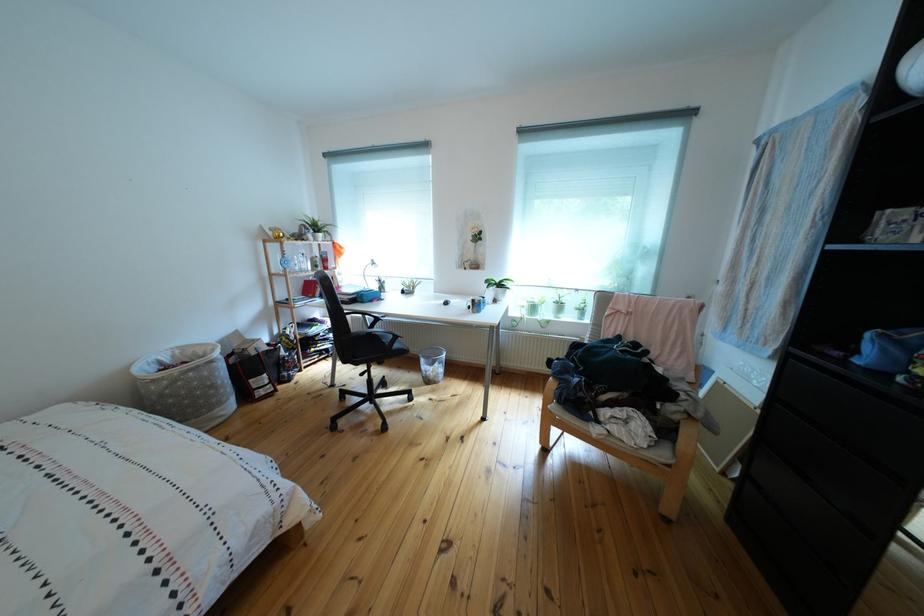
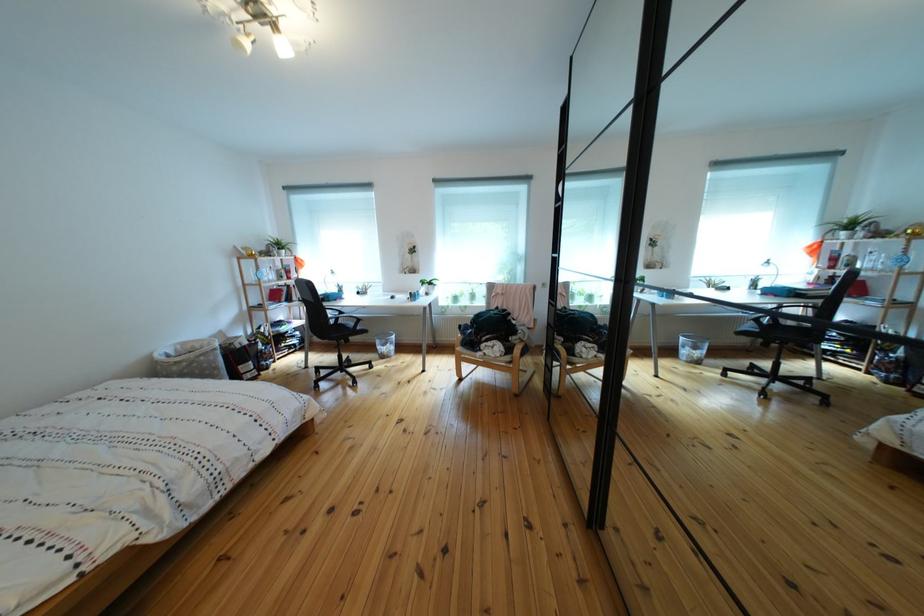
Locate, in the second image, the point that corresponds to point 185,362 in the first image.

(187, 355)